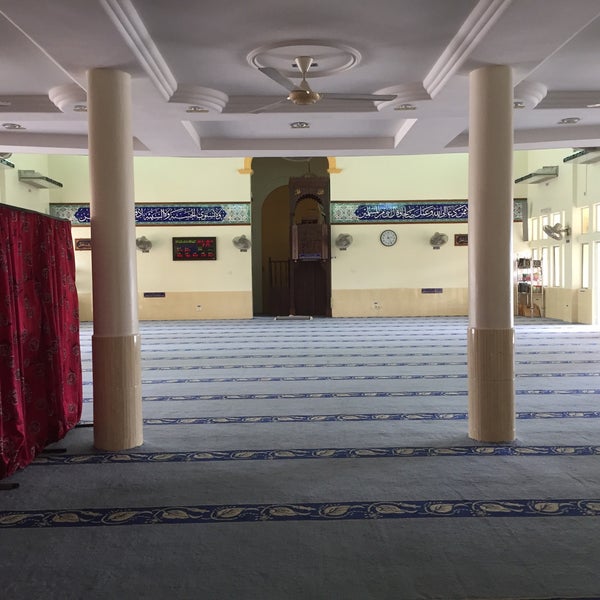
Locate an element on the screen. pillar is located at coordinates (121, 395).